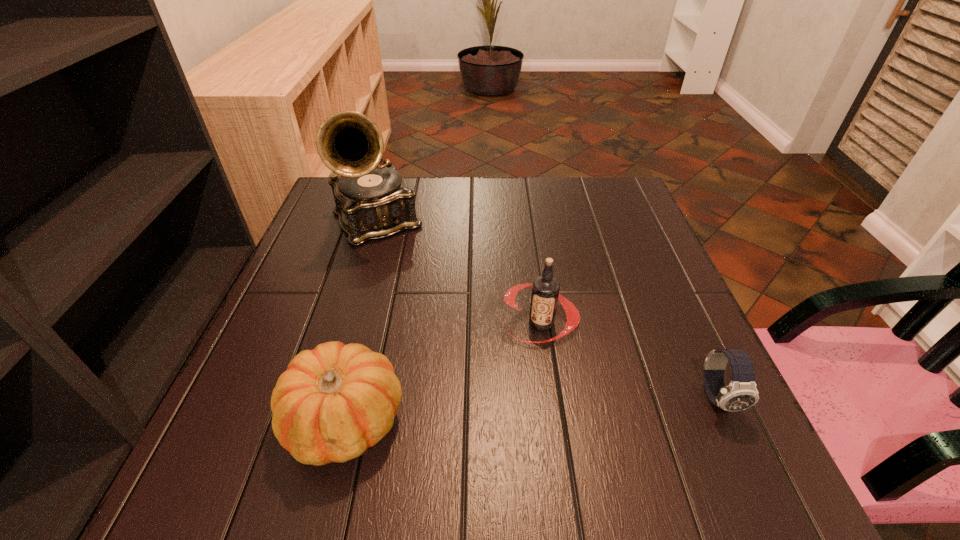
This screenshot has width=960, height=540. Find the location of `blank area located on the horn of the farthest object`. blank area located on the horn of the farthest object is located at coordinates (425, 307).

The height and width of the screenshot is (540, 960). I want to click on free point located 0.260m on the horn of the farthest object, so click(x=433, y=319).

Find the location of `vacant space situated on the horn of the farthest object`. vacant space situated on the horn of the farthest object is located at coordinates (425, 307).

Where is `object located at the far edge`? object located at the far edge is located at coordinates (373, 202).

In order to click on gourd that is at the near edge in this screenshot , I will do `click(334, 402)`.

Where is `watch that is at the near edge`? watch that is at the near edge is located at coordinates (741, 393).

Identify the location of gourd present at the left edge. This screenshot has height=540, width=960. (334, 402).

Locate an element on the screen. The height and width of the screenshot is (540, 960). phonograph record situated at the left edge is located at coordinates (373, 202).

You are a GUI agent. You are given a task and a screenshot of the screen. Output one action in this format:
    pyautogui.click(x=<x>, y=<y>)
    Task: Click on the object that is at the right edge
    
    Given the screenshot: What is the action you would take?
    pyautogui.click(x=741, y=393)

At what (x,y) coordinates should I click in order to perform the action: click on object positioned at the far left corner. Please return your answer as a coordinate pair (x, y). The image size is (960, 540). Looking at the image, I should click on (373, 202).